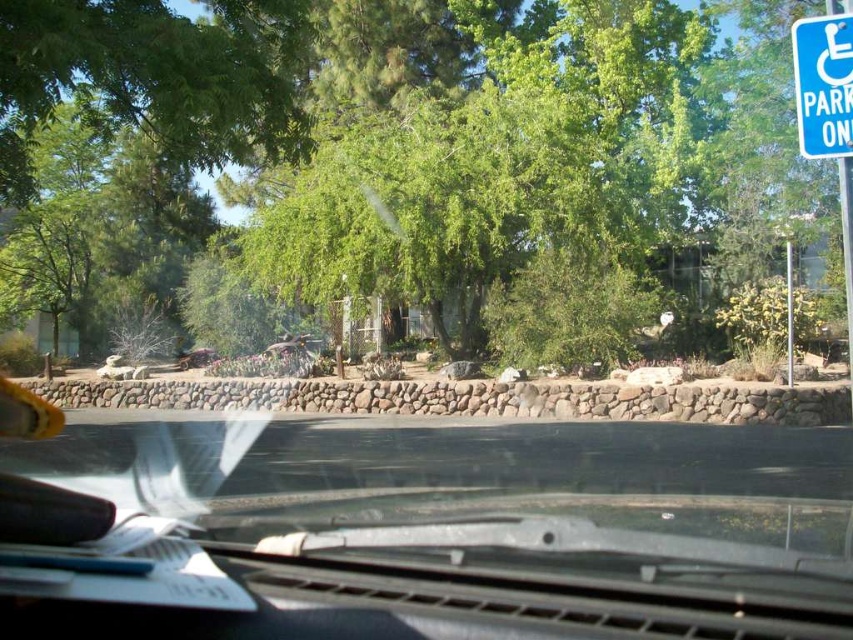
Is transparent glass windshield at center thinner than blue plastic parking sign at upper right?

In fact, transparent glass windshield at center might be wider than blue plastic parking sign at upper right.

Which of these two, transparent glass windshield at center or blue plastic parking sign at upper right, stands shorter?

transparent glass windshield at center is shorter.

Between point (722, 624) and point (850, 77), which one is positioned in front?

Point (722, 624) is in front.

The height and width of the screenshot is (640, 853). Identify the location of transparent glass windshield at center. (448, 532).

Can you confirm if green leafy tree at center is wider than blue plastic parking sign at upper right?

Correct, the width of green leafy tree at center exceeds that of blue plastic parking sign at upper right.

Locate an element on the screen. The image size is (853, 640). green leafy tree at center is located at coordinates (393, 152).

Who is more forward, (390, 256) or (840, 33)?

Point (840, 33) is in front.

Image resolution: width=853 pixels, height=640 pixels. Find the location of `green leafy tree at center`. green leafy tree at center is located at coordinates (393, 152).

Is point (76, 202) positioned in front of point (793, 512)?

No, (76, 202) is behind (793, 512).

Is green leafy tree at center wider than transparent glass windshield at center?

Indeed, green leafy tree at center has a greater width compared to transparent glass windshield at center.

Identify the location of green leafy tree at center. (393, 152).

Find the location of a particular element. The height and width of the screenshot is (640, 853). green leafy tree at center is located at coordinates (393, 152).